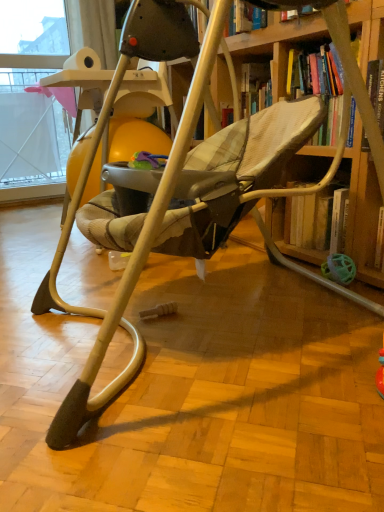
Describe the element at coordinates (31, 130) in the screenshot. I see `transparent glass door at upper left` at that location.

Locate an element on the screen. The width and height of the screenshot is (384, 512). transparent glass door at upper left is located at coordinates (31, 130).

Where is `transparent glass door at upper left`? The width and height of the screenshot is (384, 512). transparent glass door at upper left is located at coordinates (31, 130).